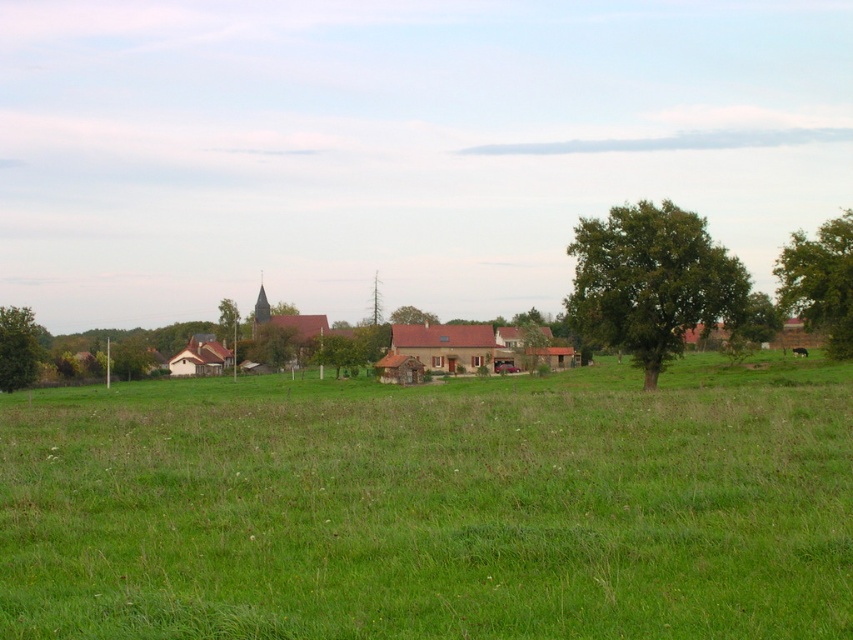
You are a farmer who wants to plant a new crop in the green grass pasture at center. Considering the height of the green leafy tree at center, do you think the tree will cast enough shade to protect the crops from the afternoon sun?

The green leafy tree at center is taller than the green grass pasture at center, so it will cast enough shade to protect the crops from the afternoon sun.

You are an environmental scientist assessing the biodiversity of this rural landscape. You observe the green leafy tree at left and the green leafy tree at center. Which tree would you recommend for a study on tree growth patterns, and why?

The green leafy tree at center should be chosen for the study on tree growth patterns because it is larger than the green leafy tree at left, indicating potential differences in age, environmental conditions, or resource availability that could provide valuable insights into growth factors.